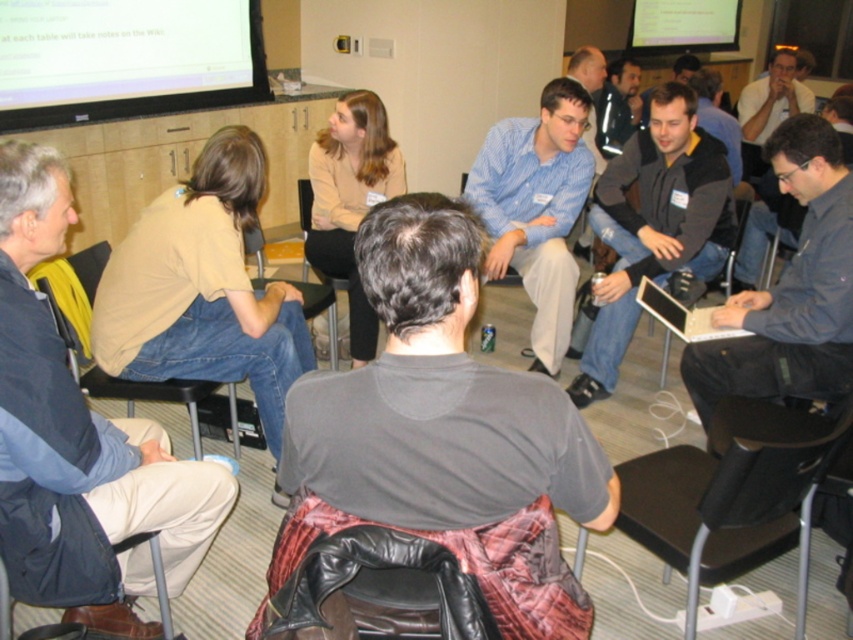
Question: Observing the image, what is the correct spatial positioning of dark blue jacket at left in reference to dark gray shirt at center?

Choices:
 (A) below
 (B) above

Answer: (A)

Question: Observing the image, what is the correct spatial positioning of matte black projector screen at upper left in reference to black leather chair at center?

Choices:
 (A) below
 (B) above

Answer: (B)

Question: Is matte black projector screen at upper left above black plastic chair at lower right?

Choices:
 (A) no
 (B) yes

Answer: (B)

Question: Which object is positioned farthest from the blue striped shirt at center?

Choices:
 (A) matte black projector screen at upper left
 (B) black leather chair at lower left
 (C) leather at lower left
 (D) black leather chair at lower right

Answer: (C)

Question: Which object appears farthest from the camera in this image?

Choices:
 (A) black leather chair at center
 (B) dark blue jacket at left
 (C) white glossy projector screen at upper center
 (D) matte black projector screen at upper left

Answer: (C)

Question: Which point is closer to the camera?

Choices:
 (A) (97, 476)
 (B) (654, 33)
 (C) (579, 140)

Answer: (A)